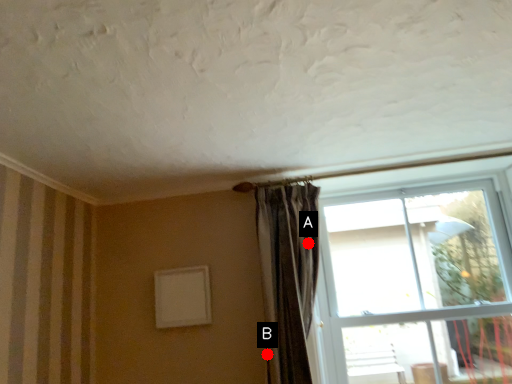
Question: Two points are circled on the image, labeled by A and B beside each circle. Which point is closer to the camera taking this photo?

Choices:
 (A) A is closer
 (B) B is closer

Answer: (B)